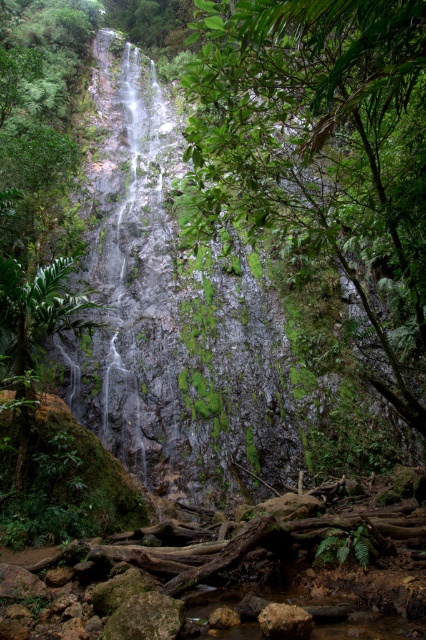
Measure the distance from green mossy rock at lower center to rusty metallic rock at lower center.

green mossy rock at lower center and rusty metallic rock at lower center are 36.94 inches apart.

How distant is green mossy rock at lower center from rusty metallic rock at lower center?

green mossy rock at lower center and rusty metallic rock at lower center are 93.83 centimeters apart from each other.

Measure the distance between point (172, 618) and camera.

The distance of point (172, 618) from camera is 5.11 meters.

Find the location of a particular element. green mossy rock at lower center is located at coordinates (146, 618).

Which is behind, point (192, 76) or point (285, 628)?

Point (192, 76)

What do you see at coordinates (325, 150) in the screenshot? This screenshot has height=640, width=426. I see `green mossy rock at center` at bounding box center [325, 150].

Identify the location of green mossy rock at center. (325, 150).

Describe the element at coordinates (325, 150) in the screenshot. I see `green mossy rock at center` at that location.

Is green mossy rock at center further to camera compared to green mossy rock at lower center?

No, green mossy rock at center is in front of green mossy rock at lower center.

Who is more forward, (419, 365) or (118, 616)?

Point (118, 616) is in front.

Locate an element on the screen. green mossy rock at center is located at coordinates (325, 150).